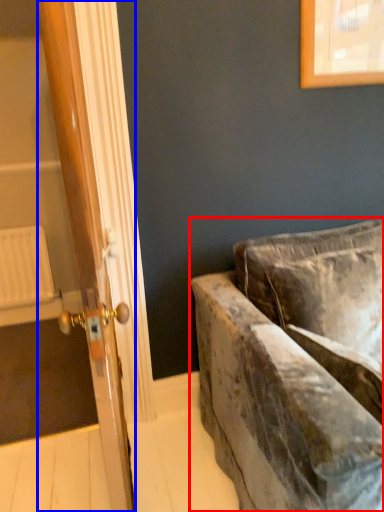
Question: Which point is closer to the camera, studio couch (highlighted by a red box) or door (highlighted by a blue box)?

Choices:
 (A) studio couch
 (B) door

Answer: (A)